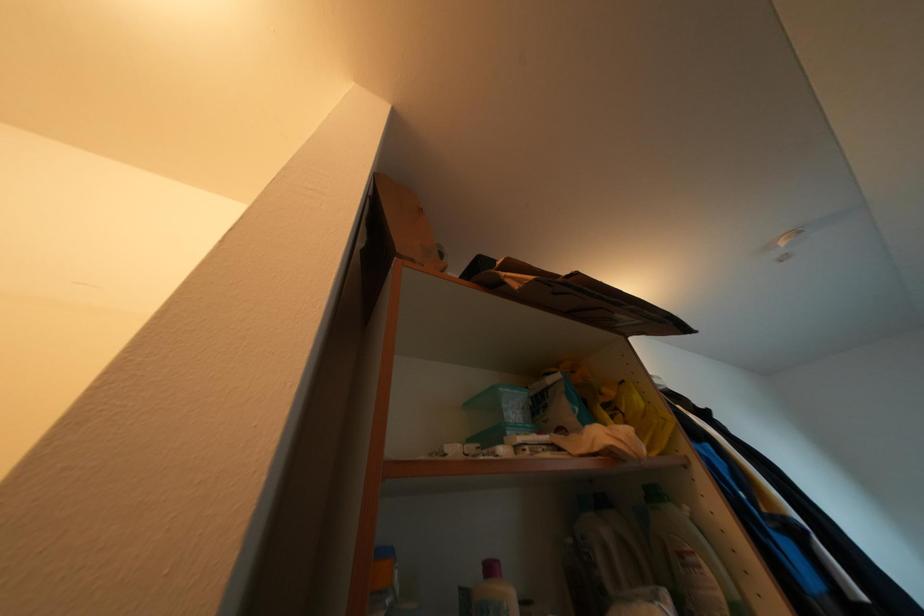
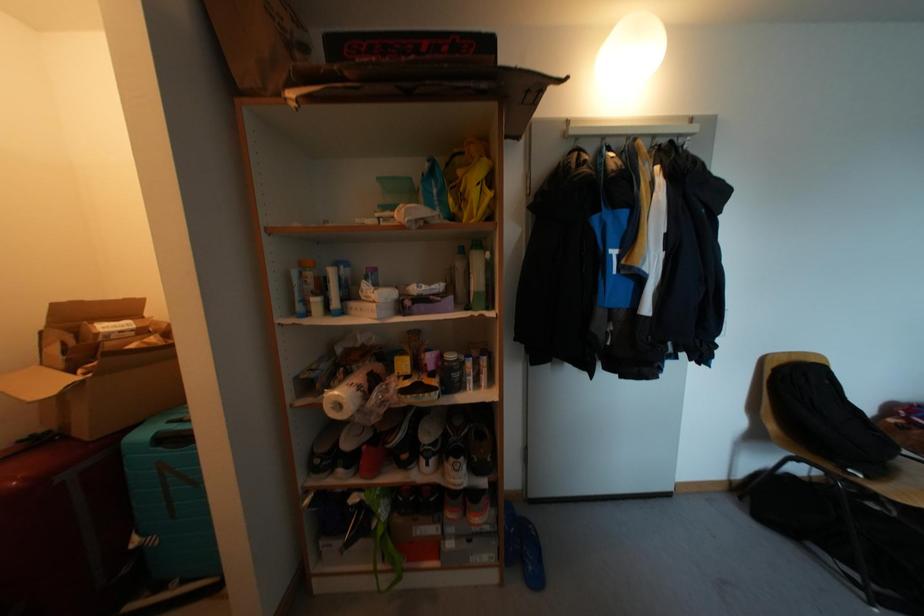
The images are taken continuously from a first-person perspective. In which direction is your viewpoint rotating?

The rotation direction of the camera is left-down.